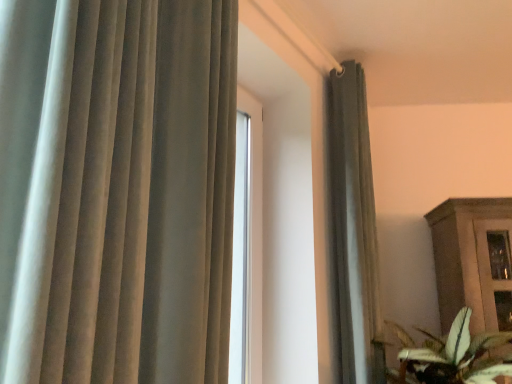
Question: Are satin gray curtain at upper right and green leafy plant at lower right making contact?

Choices:
 (A) no
 (B) yes

Answer: (A)

Question: From the image's perspective, is satin gray curtain at upper right located beneath green leafy plant at lower right?

Choices:
 (A) yes
 (B) no

Answer: (B)

Question: Is satin gray curtain at upper right to the left of green leafy plant at lower right from the viewer's perspective?

Choices:
 (A) no
 (B) yes

Answer: (B)

Question: From a real-world perspective, is satin gray curtain at upper right positioned over green leafy plant at lower right based on gravity?

Choices:
 (A) no
 (B) yes

Answer: (B)

Question: Are satin gray curtain at upper right and green leafy plant at lower right located far from each other?

Choices:
 (A) yes
 (B) no

Answer: (B)

Question: Does satin gray curtain at upper right have a lesser height compared to green leafy plant at lower right?

Choices:
 (A) no
 (B) yes

Answer: (A)

Question: Is green leafy plant at lower right oriented towards satin gray curtain at upper right?

Choices:
 (A) yes
 (B) no

Answer: (B)

Question: Is green leafy plant at lower right turned away from satin gray curtain at upper right?

Choices:
 (A) no
 (B) yes

Answer: (B)

Question: From the image's perspective, is green leafy plant at lower right above satin gray curtain at upper right?

Choices:
 (A) no
 (B) yes

Answer: (A)

Question: Is green leafy plant at lower right directly adjacent to satin gray curtain at upper right?

Choices:
 (A) yes
 (B) no

Answer: (B)

Question: From the image's perspective, would you say green leafy plant at lower right is shown under satin gray curtain at upper right?

Choices:
 (A) yes
 (B) no

Answer: (A)

Question: Can you confirm if green leafy plant at lower right is positioned to the right of satin gray curtain at upper right?

Choices:
 (A) no
 (B) yes

Answer: (B)

Question: From the image's perspective, relative to green leafy plant at lower right, is satin gray curtain at upper right above or below?

Choices:
 (A) below
 (B) above

Answer: (B)